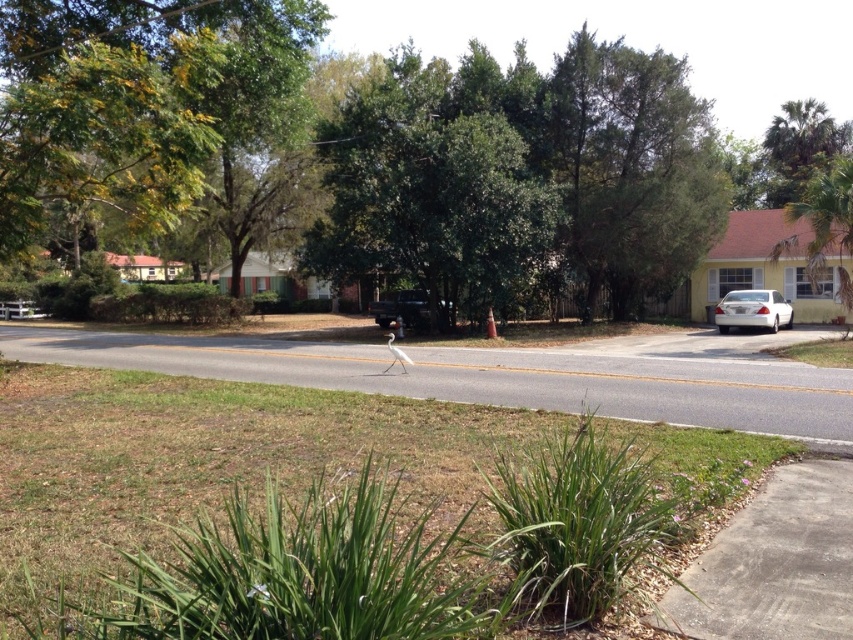
Based on the photo, you are a birdwatcher observing the suburban street scene. You notice the green leafy tree at upper left and the green leafy palm tree at upper right. Which tree would provide a better vantage point for observing the white bird walking on the road?

The green leafy palm tree at upper right is taller than the green leafy tree at upper left, so it would provide a better vantage point for observing the white bird walking on the road.

You are standing at the center of the road and looking towards the houses. Which tree, the green leafy tree at upper left or the green leafy palm tree at upper right, blocks your view of the house behind them?

The green leafy tree at upper left is in front of the green leafy palm tree at upper right, so it blocks the view of the house behind them.

You are a delivery driver who needs to park your matte black truck at center near the curb. There is a green leafy tree at upper right in the way. Can you park there without hitting the tree?

The green leafy tree at upper right is larger than the matte black truck at center, so there is a risk of the truck hitting the tree when parking. Choose a different spot farther from the tree.